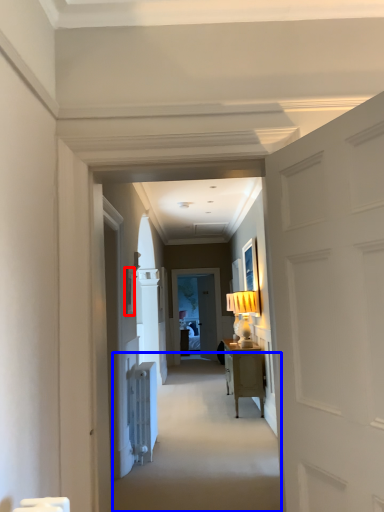
Question: Which of the following is the farthest to the observer, picture frame (highlighted by a red box) or path (highlighted by a blue box)?

Choices:
 (A) picture frame
 (B) path

Answer: (A)